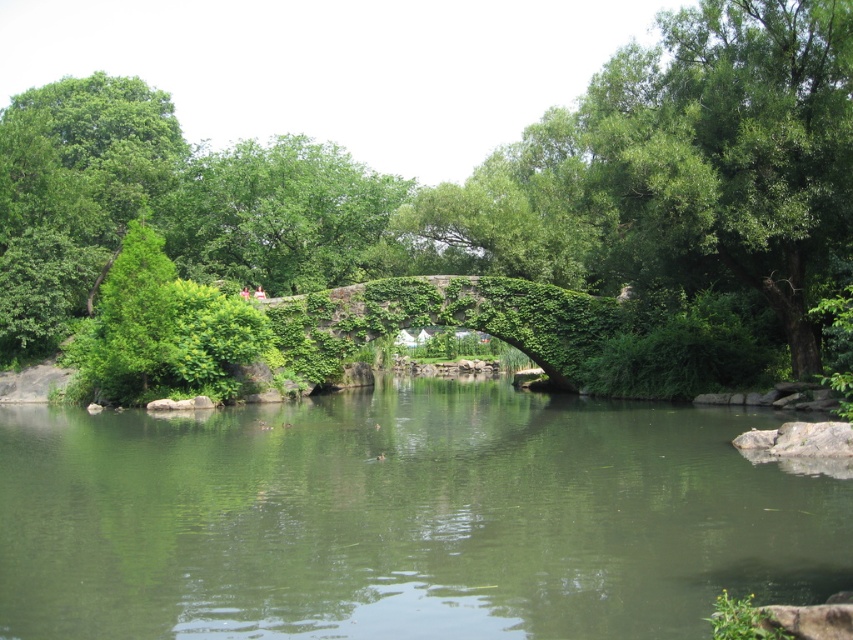
Who is taller, green leafy tree at center or green mossy river at center?

With more height is green leafy tree at center.

Which is behind, point (718, 60) or point (347, 554)?

Positioned behind is point (718, 60).

You are a GUI agent. You are given a task and a screenshot of the screen. Output one action in this format:
    pyautogui.click(x=<x>, y=<y>)
    Task: Click on the green leafy tree at center
    The width and height of the screenshot is (853, 640).
    Given the screenshot: What is the action you would take?
    pyautogui.click(x=495, y=209)

Is point (735, 189) positioned in front of point (602, 298)?

Yes.

Does green leafy tree at center have a greater height compared to green ivy-covered bridge at center?

Yes.

The height and width of the screenshot is (640, 853). Describe the element at coordinates (495, 209) in the screenshot. I see `green leafy tree at center` at that location.

Where is `green leafy tree at center`? green leafy tree at center is located at coordinates (495, 209).

Between point (300, 620) and point (369, 305), which one is positioned in front?

Positioned in front is point (300, 620).

Is green mossy river at center above green ivy-covered bridge at center?

No, green mossy river at center is not above green ivy-covered bridge at center.

What do you see at coordinates (403, 516) in the screenshot? This screenshot has height=640, width=853. I see `green mossy river at center` at bounding box center [403, 516].

Find the location of `green mossy river at center`. green mossy river at center is located at coordinates (403, 516).